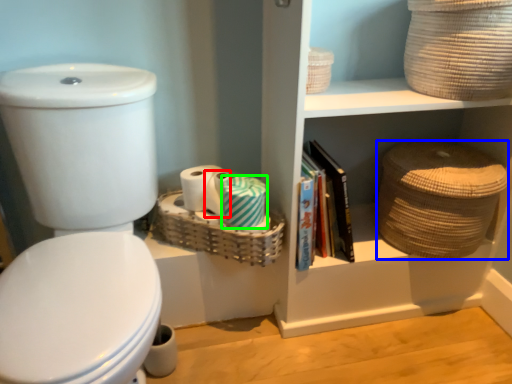
Question: Estimate the real-world distances between objects in this image. Which object is closer to toilet paper (highlighted by a red box), basket (highlighted by a blue box) or toilet paper (highlighted by a green box)?

Choices:
 (A) basket
 (B) toilet paper

Answer: (B)